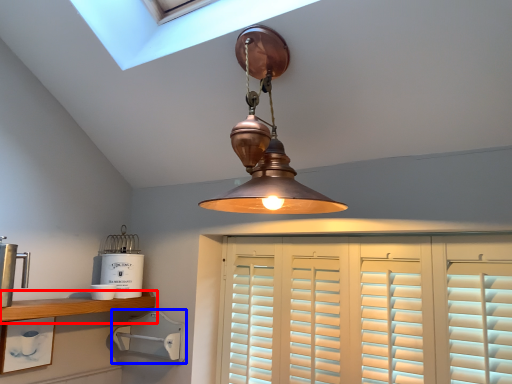
Question: Which of the following is the farthest to the observer, shelf (highlighted by a red box) or appliance (highlighted by a blue box)?

Choices:
 (A) shelf
 (B) appliance

Answer: (B)